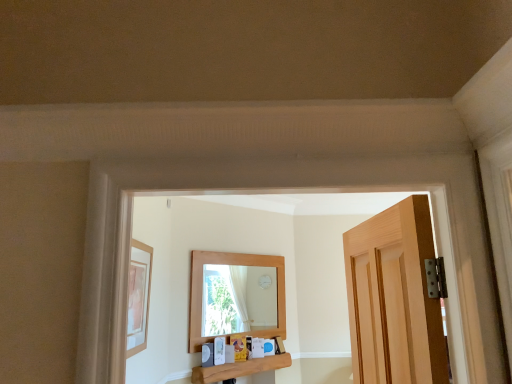
Question: From the image's perspective, is wooden picture frame at left positioned above or below wooden shelf at center?

Choices:
 (A) above
 (B) below

Answer: (A)

Question: Is point (139, 321) closer or farther from the camera than point (206, 380)?

Choices:
 (A) farther
 (B) closer

Answer: (B)

Question: Is wooden picture frame at left wider or thinner than wooden shelf at center?

Choices:
 (A) thin
 (B) wide

Answer: (A)

Question: Is point (264, 362) closer or farther from the camera than point (135, 296)?

Choices:
 (A) closer
 (B) farther

Answer: (B)

Question: Is wooden shelf at center in front of or behind wooden picture frame at left in the image?

Choices:
 (A) behind
 (B) front

Answer: (A)

Question: From a real-world perspective, is wooden shelf at center positioned above or below wooden picture frame at left?

Choices:
 (A) below
 (B) above

Answer: (A)

Question: Is wooden shelf at center to the left or to the right of wooden picture frame at left in the image?

Choices:
 (A) left
 (B) right

Answer: (B)